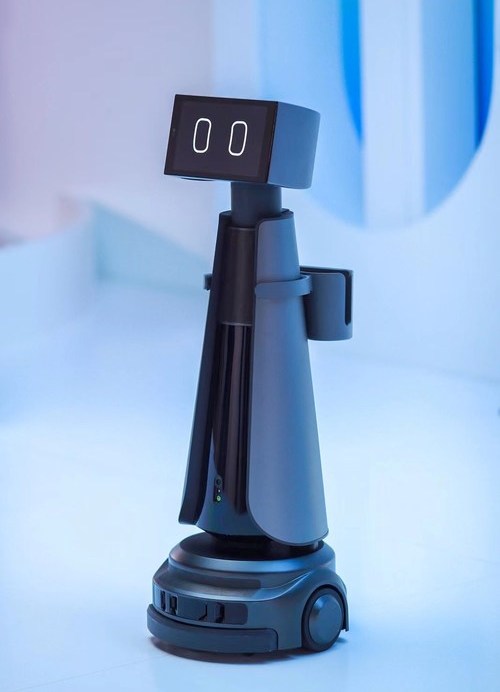
This screenshot has width=500, height=692. Identify the location of window in wall. (462, 82).